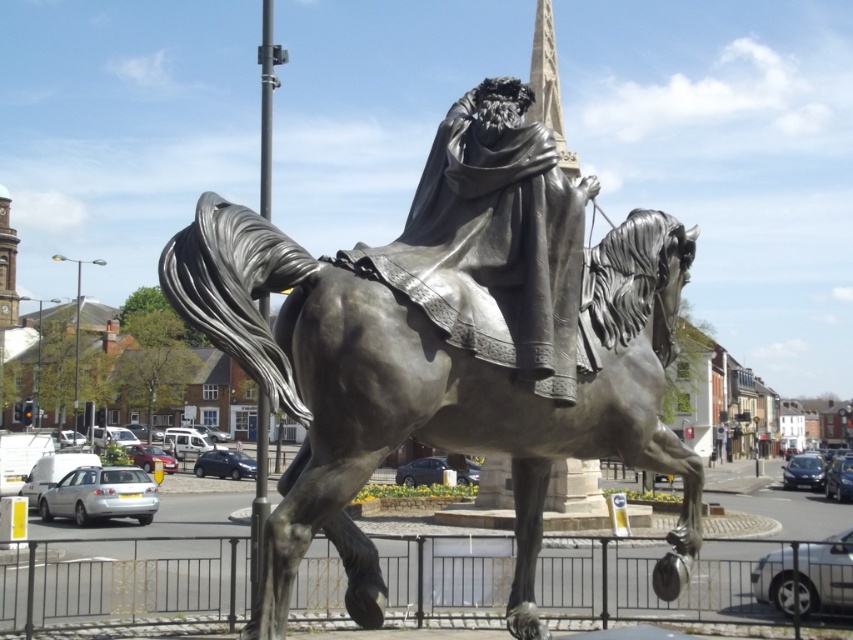
You are a maintenance worker needing to clean both the bronze statue at center and the bronze draped figure at center. If your cleaning tool can only reach 1 meter, can you clean both without moving the tool?

The bronze statue at center and bronze draped figure at center are 1.16 meters apart from each other. Since the tool can only reach 1 meter, you cannot clean both without moving the tool.

You are an art student visiting the town square and want to sketch the bronze statue at center and the bronze draped figure at center. Which one should you focus on first if you want to capture the tallest object in your drawing?

The bronze statue at center is much taller than the bronze draped figure at center, so you should focus on the bronze statue at center first to capture the tallest object in your drawing.